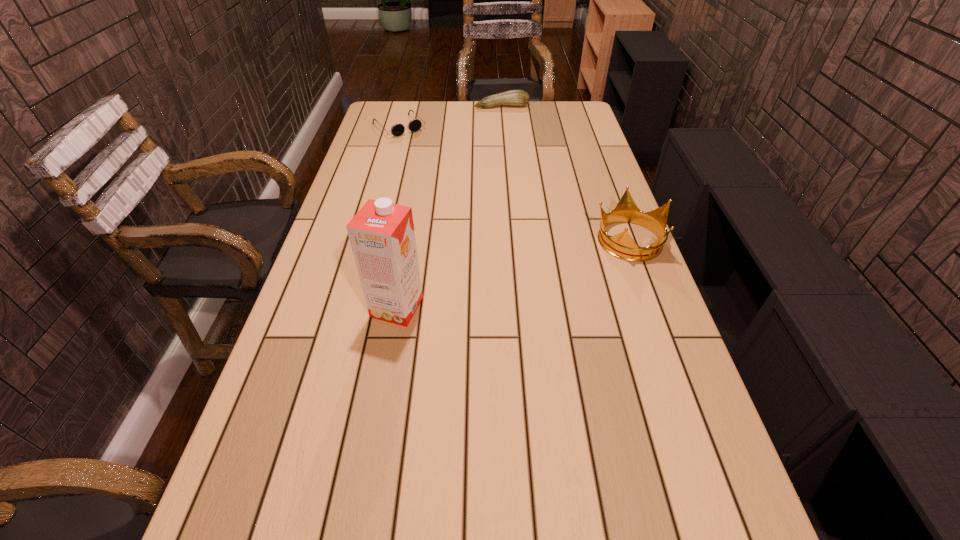
The width and height of the screenshot is (960, 540). Find the location of `free space in the image that satisfies the following two spatial constraints: 1. on the back side of the carton; 2. on the right side of the farthest object`. free space in the image that satisfies the following two spatial constraints: 1. on the back side of the carton; 2. on the right side of the farthest object is located at coordinates (432, 106).